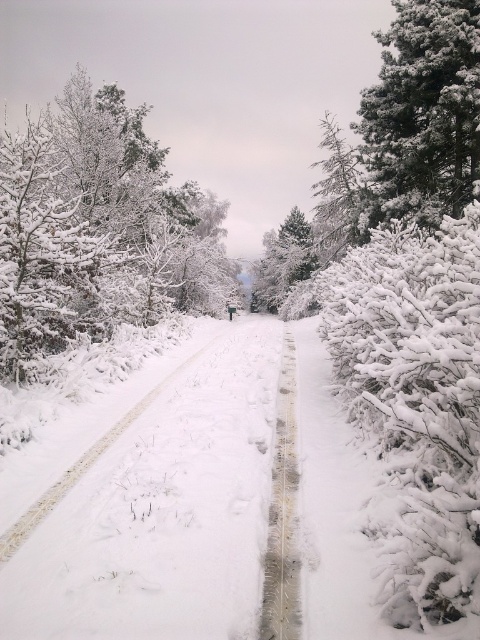
Question: Is the position of white frosty tree at left more distant than that of white snow-covered tree at upper right?

Choices:
 (A) no
 (B) yes

Answer: (A)

Question: Observing the image, what is the correct spatial positioning of white snow-covered tree at upper right in reference to green textured pine at center?

Choices:
 (A) left
 (B) right

Answer: (B)

Question: Which of the following is the closest to the observer?

Choices:
 (A) (383, 129)
 (B) (131, 232)
 (C) (278, 232)

Answer: (A)

Question: Considering the real-world distances, which object is closest to the green textured pine at center?

Choices:
 (A) white frosty tree at left
 (B) white snow-covered tree at upper right

Answer: (A)

Question: Which of the following is the farthest from the observer?

Choices:
 (A) green textured pine at center
 (B) white frosty tree at left

Answer: (A)

Question: From the image, what is the correct spatial relationship of white frosty tree at left in relation to white snow-covered tree at upper right?

Choices:
 (A) above
 (B) below

Answer: (A)